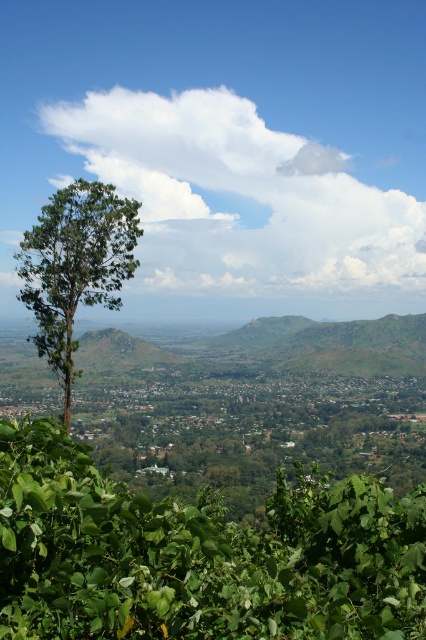
The width and height of the screenshot is (426, 640). Describe the element at coordinates (198, 556) in the screenshot. I see `green leafy tree at lower left` at that location.

Between point (281, 532) and point (77, 212), which one is positioned behind?

The point (77, 212) is more distant.

Is point (313, 480) farther from viewer compared to point (29, 288)?

That is False.

This screenshot has width=426, height=640. What are the coordinates of `green leafy tree at lower left` in the screenshot? It's located at pyautogui.click(x=198, y=556).

Is green leafy tree at lower left wider than white fluffy cloud at upper center?

No, green leafy tree at lower left is not wider than white fluffy cloud at upper center.

Find the location of a particular element. green leafy tree at lower left is located at coordinates (198, 556).

Does point (367, 262) come closer to viewer compared to point (83, 180)?

No, it is behind (83, 180).

Does white fluffy cloud at upper center have a smaller size compared to green leafy tree at left?

No.

Which is in front, point (227, 218) or point (112, 298)?

Point (112, 298) is in front.

Locate an element on the screen. white fluffy cloud at upper center is located at coordinates (241, 198).